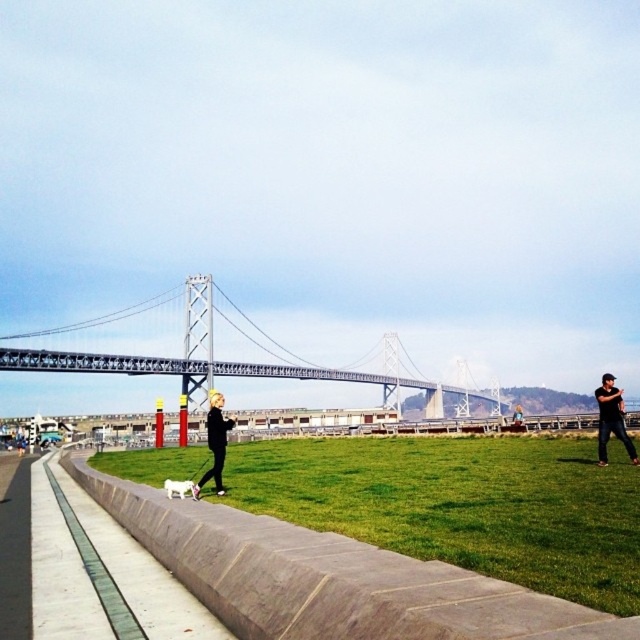
Question: Does green grass at lower center appear on the left side of black matte jacket at lower left?

Choices:
 (A) yes
 (B) no

Answer: (B)

Question: Which of the following is the farthest from the observer?

Choices:
 (A) green grass at lower center
 (B) white fur dog at center
 (C) black matte person at right
 (D) metallic steel bridge at center

Answer: (D)

Question: Can you confirm if green grass at lower center is wider than black matte person at right?

Choices:
 (A) yes
 (B) no

Answer: (B)

Question: Which point is farther to the camera?

Choices:
 (A) (628, 444)
 (B) (308, 500)
 (C) (195, 355)

Answer: (C)

Question: Considering the relative positions of metallic steel bridge at center and white fur dog at center in the image provided, where is metallic steel bridge at center located with respect to white fur dog at center?

Choices:
 (A) left
 (B) right

Answer: (B)

Question: Based on their relative distances, which object is farther from the black matte person at right?

Choices:
 (A) white fur dog at center
 (B) black matte jacket at lower left
 (C) metallic steel bridge at center

Answer: (C)